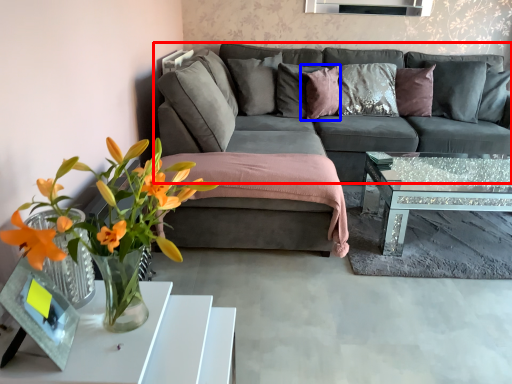
Question: Which point is further to the camera, studio couch (highlighted by a red box) or pillow (highlighted by a blue box)?

Choices:
 (A) studio couch
 (B) pillow

Answer: (B)